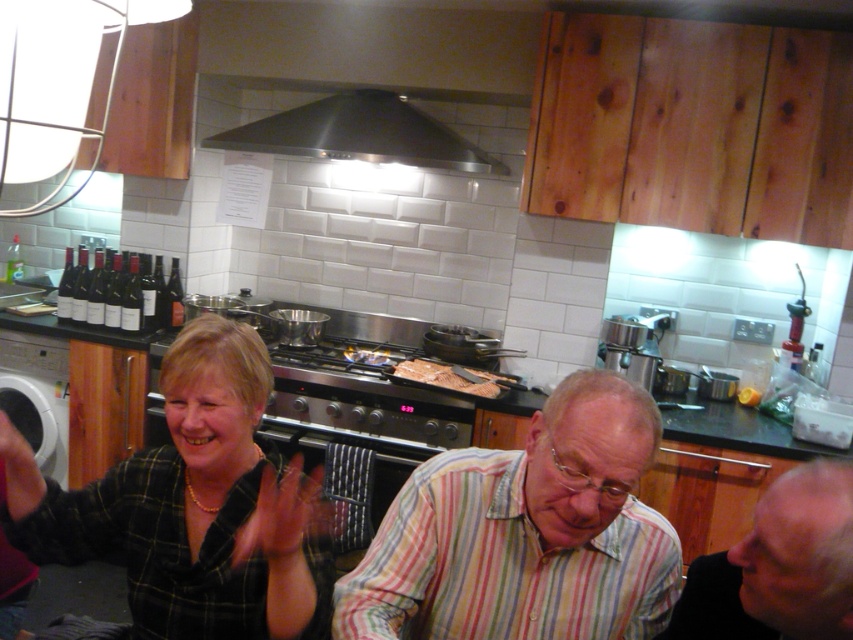
Is stainless steel exhaust hood at upper center to the right of matte black bottles at left from the viewer's perspective?

Correct, you'll find stainless steel exhaust hood at upper center to the right of matte black bottles at left.

Where is `stainless steel exhaust hood at upper center`? stainless steel exhaust hood at upper center is located at coordinates (360, 134).

I want to click on stainless steel exhaust hood at upper center, so click(360, 134).

Between white glossy dishwasher at left and brown matte meat at center, which one is positioned higher?

Positioned higher is brown matte meat at center.

Who is positioned more to the right, white glossy dishwasher at left or brown matte meat at center?

brown matte meat at center is more to the right.

Is point (41, 381) farther from viewer compared to point (474, 380)?

Yes, it is.

Locate an element on the screen. white glossy dishwasher at left is located at coordinates (36, 396).

Who is more distant from viewer, (465, 170) or (413, 362)?

Point (413, 362)

Between stainless steel exhaust hood at upper center and brown matte meat at center, which one has more height?

stainless steel exhaust hood at upper center is taller.

Between point (351, 106) and point (430, 362), which one is positioned in front?

Point (430, 362) is in front.

You are a GUI agent. You are given a task and a screenshot of the screen. Output one action in this format:
    pyautogui.click(x=<x>, y=<y>)
    Task: Click on the stainless steel exhaust hood at upper center
    Image resolution: width=853 pixels, height=640 pixels.
    Given the screenshot: What is the action you would take?
    pyautogui.click(x=360, y=134)